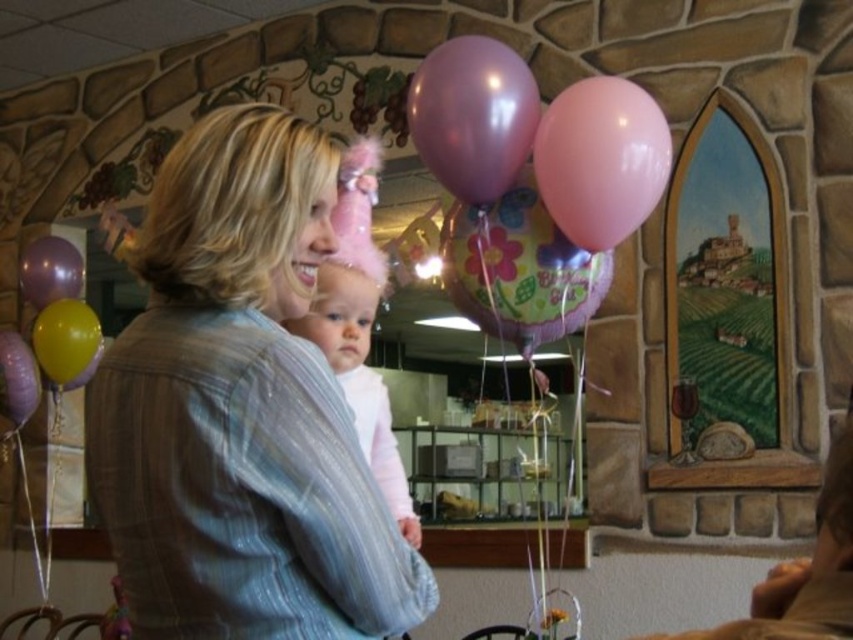
Based on the photo, between purple glossy balloon at center and yellow rubber balloon at left, which one appears on the left side from the viewer's perspective?

Positioned to the left is yellow rubber balloon at left.

The height and width of the screenshot is (640, 853). I want to click on purple glossy balloon at center, so click(473, 115).

Where is `purple glossy balloon at center`? purple glossy balloon at center is located at coordinates (473, 115).

The height and width of the screenshot is (640, 853). I want to click on purple glossy balloon at center, so click(473, 115).

Based on the photo, does pink glossy balloon at upper center appear over matte purple balloon at left?

Indeed, pink glossy balloon at upper center is positioned over matte purple balloon at left.

Does pink glossy balloon at upper center have a larger size compared to matte purple balloon at left?

Yes.

You are a GUI agent. You are given a task and a screenshot of the screen. Output one action in this format:
    pyautogui.click(x=<x>, y=<y>)
    Task: Click on the pink glossy balloon at upper center
    The width and height of the screenshot is (853, 640).
    Given the screenshot: What is the action you would take?
    pyautogui.click(x=601, y=161)

Can you confirm if matte gray jacket at center is positioned above matte yellow balloon at left?

Yes, matte gray jacket at center is above matte yellow balloon at left.

Does matte gray jacket at center have a greater height compared to matte yellow balloon at left?

Yes.

Is point (108, 397) less distant than point (35, 372)?

That is True.

Where is `matte gray jacket at center`? matte gray jacket at center is located at coordinates (241, 410).